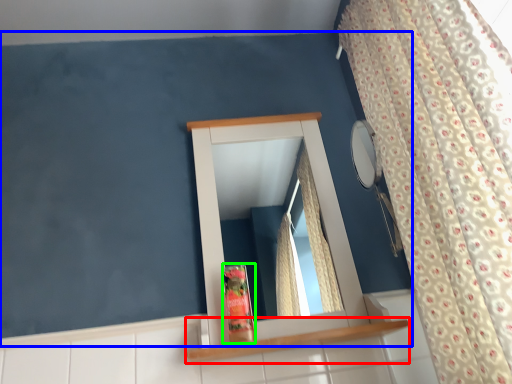
Question: Which object is the farthest from shelf (highlighted by a red box)? Choose among these: backdrop (highlighted by a blue box) or toiletry (highlighted by a green box).

Choices:
 (A) backdrop
 (B) toiletry

Answer: (A)